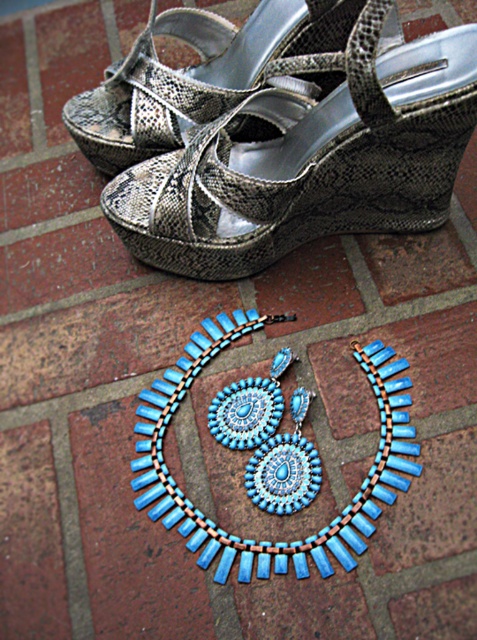
Is snake skin silver sandal at upper center closer to camera compared to shiny metallic sandal at upper center?

Yes, snake skin silver sandal at upper center is in front of shiny metallic sandal at upper center.

Is point (197, 184) positioned before point (187, 90)?

Yes, point (197, 184) is closer to viewer.

Is point (125, 218) less distant than point (134, 145)?

Yes, it is in front of point (134, 145).

Find the location of a particular element. snake skin silver sandal at upper center is located at coordinates (310, 161).

Does point (240, 563) come farther from viewer compared to point (240, 84)?

No, it is in front of (240, 84).

Does point (367, 499) come closer to viewer compared to point (104, 70)?

Yes, point (367, 499) is in front of point (104, 70).

Locate an element on the screen. This screenshot has width=477, height=640. turquoise beaded necklace at center is located at coordinates [x=269, y=540].

Is snake skin silver sandal at upper center to the right of turquoise beaded necklace at center from the viewer's perspective?

Yes, snake skin silver sandal at upper center is to the right of turquoise beaded necklace at center.

The image size is (477, 640). Identify the location of snake skin silver sandal at upper center. coord(310,161).

Is point (360, 161) behind point (217, 544)?

Yes.

The width and height of the screenshot is (477, 640). Find the location of `snake skin silver sandal at upper center`. snake skin silver sandal at upper center is located at coordinates (310, 161).